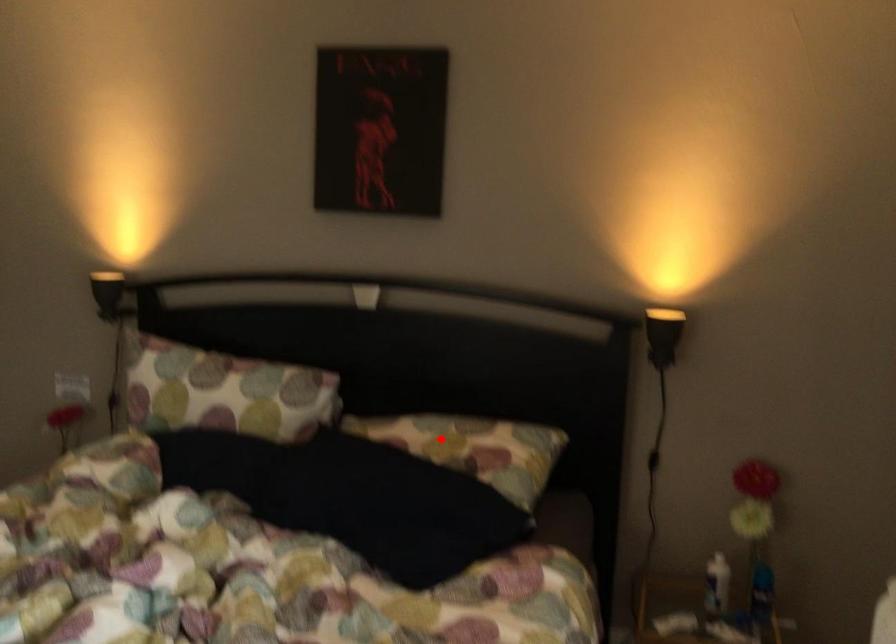
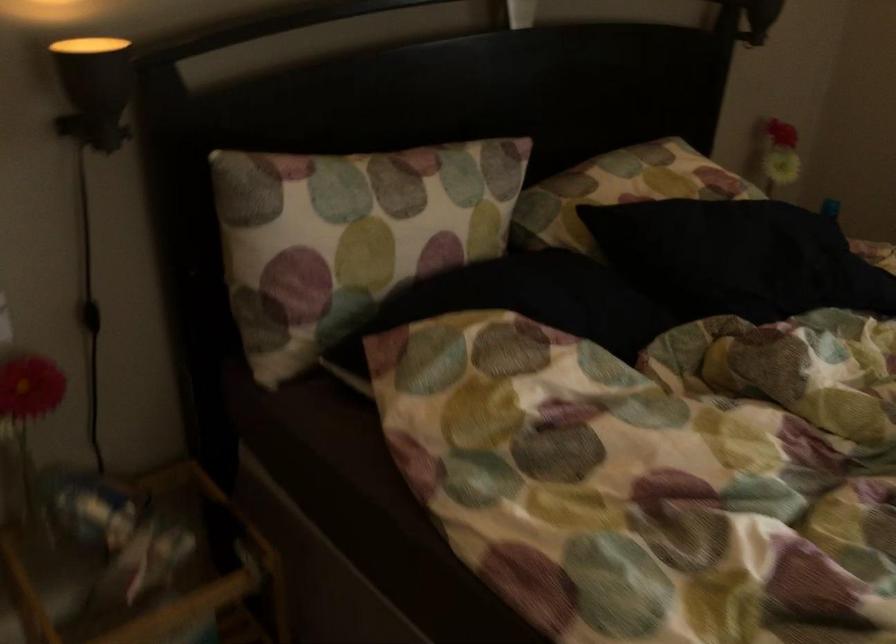
The point at the highlighted location is marked in the first image. Where is the corresponding point in the second image?

(649, 176)